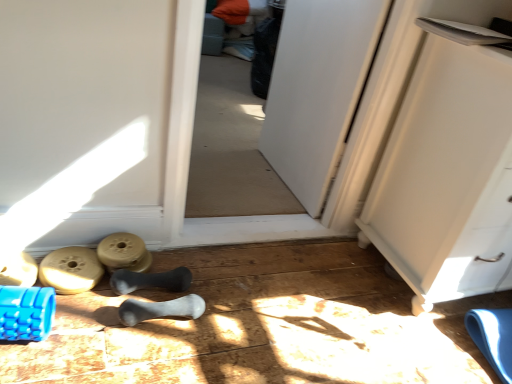
Image resolution: width=512 pixels, height=384 pixels. Describe the element at coordinates (160, 309) in the screenshot. I see `gray rubber bone at center, arranged as the first footwear when viewed from the right` at that location.

Find the location of a particular element. This screenshot has height=384, width=512. gray rubber bone at center, arranged as the 4th footwear when viewed from the left is located at coordinates 160,309.

What is the approximate width of blue textured foam roller at lower left, marked as the 1th job in a front-to-back arrangement?

blue textured foam roller at lower left, marked as the 1th job in a front-to-back arrangement, is 5.84 inches in width.

What do you see at coordinates (19, 271) in the screenshot?
I see `blue rubber roller at lower left, which appears as the fourth footwear when viewed from the right` at bounding box center [19, 271].

Find the location of a particular element. blue rubber roller at lower left, placed as the 1th footwear when sorted from left to right is located at coordinates (19, 271).

Where is `white matte cabinet at right`? This screenshot has height=384, width=512. white matte cabinet at right is located at coordinates 447,176.

The width and height of the screenshot is (512, 384). Find the location of `gray rubber bone at center, arranged as the first footwear when viewed from the right`. gray rubber bone at center, arranged as the first footwear when viewed from the right is located at coordinates (160, 309).

From a real-world perspective, which footwear is the 2nd one underneath the white matte cabinet at right? Please provide its 2D coordinates.

[(19, 271)]

Is blue rubber roller at lower left, which appears as the fourth footwear when viewed from the right, oriented towards white matte cabinet at right?

No, blue rubber roller at lower left, which appears as the fourth footwear when viewed from the right, is not turned towards white matte cabinet at right.

In the scene shown: Is blue rubber roller at lower left, placed as the 1th footwear when sorted from left to right, far away from white matte cabinet at right?

Yes, blue rubber roller at lower left, placed as the 1th footwear when sorted from left to right, and white matte cabinet at right are quite far apart.

Is gray rubber bone at center, which is the 3th footwear in left-to-right order, turned away from blue textured foam roller at lower left, positioned as the 2th job in right-to-left order?

No, gray rubber bone at center, which is the 3th footwear in left-to-right order,'s orientation is not away from blue textured foam roller at lower left, positioned as the 2th job in right-to-left order.

Would you say blue textured foam roller at lower left, positioned as the 2th job in right-to-left order, is part of gray rubber bone at center, positioned as the 2th footwear in right-to-left order,'s contents?

No, blue textured foam roller at lower left, positioned as the 2th job in right-to-left order, is not surrounded by gray rubber bone at center, positioned as the 2th footwear in right-to-left order.

Is gray rubber bone at center, positioned as the 2th footwear in right-to-left order, closer to the viewer compared to blue textured foam roller at lower left, marked as the 1th job in a front-to-back arrangement?

No, gray rubber bone at center, positioned as the 2th footwear in right-to-left order, is behind blue textured foam roller at lower left, marked as the 1th job in a front-to-back arrangement.

How far apart are matte rubber dumbbell at lower left, the 2th footwear when ordered from left to right, and white matte cabinet at right?

matte rubber dumbbell at lower left, the 2th footwear when ordered from left to right, and white matte cabinet at right are 1.16 meters apart.

Looking at this image, from the image's perspective, which is above, matte rubber dumbbell at lower left, which appears as the third footwear when viewed from the right, or white matte cabinet at right?

white matte cabinet at right appears higher in the image.

Between matte rubber dumbbell at lower left, which appears as the third footwear when viewed from the right, and white matte cabinet at right, which one has larger size?

white matte cabinet at right is bigger.

Considering the sizes of objects matte rubber dumbbell at lower left, which appears as the third footwear when viewed from the right, and white matte cabinet at right in the image provided, who is thinner, matte rubber dumbbell at lower left, which appears as the third footwear when viewed from the right, or white matte cabinet at right?

matte rubber dumbbell at lower left, which appears as the third footwear when viewed from the right, is thinner.

Is matte rubber dumbbell at lower left, which appears as the third footwear when viewed from the right, looking in the opposite direction of matte plastic weight at lower center, acting as the first job starting from the right?

matte rubber dumbbell at lower left, which appears as the third footwear when viewed from the right, is not turned away from matte plastic weight at lower center, acting as the first job starting from the right.

Consider the image. Choose the correct answer: Is matte rubber dumbbell at lower left, the 2th footwear when ordered from left to right, inside matte plastic weight at lower center, acting as the first job starting from the right, or outside it?

matte rubber dumbbell at lower left, the 2th footwear when ordered from left to right, is not inside matte plastic weight at lower center, acting as the first job starting from the right, it's outside.

From the image's perspective, between matte rubber dumbbell at lower left, the 2th footwear when ordered from left to right, and matte plastic weight at lower center, acting as the first job starting from the right, which one is located above?

matte plastic weight at lower center, acting as the first job starting from the right, from the image's perspective.

In the scene shown: From a real-world perspective, is matte rubber dumbbell at lower left, which appears as the third footwear when viewed from the right, positioned over matte plastic weight at lower center, the second job positioned from the left, based on gravity?

Actually, matte rubber dumbbell at lower left, which appears as the third footwear when viewed from the right, is physically below matte plastic weight at lower center, the second job positioned from the left, in the real world.

Is gray rubber bone at center, arranged as the first footwear when viewed from the right, facing away from blue textured foam roller at lower left, marked as the 1th job in a front-to-back arrangement?

gray rubber bone at center, arranged as the first footwear when viewed from the right, does not have its back to blue textured foam roller at lower left, marked as the 1th job in a front-to-back arrangement.

From the image's perspective, would you say gray rubber bone at center, arranged as the first footwear when viewed from the right, is shown under blue textured foam roller at lower left, acting as the second job starting from the back?

Yes, from the image's perspective, gray rubber bone at center, arranged as the first footwear when viewed from the right, is below blue textured foam roller at lower left, acting as the second job starting from the back.

Where is `the 2nd job to the left when counting from the gray rubber bone at center, arranged as the 4th footwear when viewed from the left`? This screenshot has width=512, height=384. the 2nd job to the left when counting from the gray rubber bone at center, arranged as the 4th footwear when viewed from the left is located at coordinates (26, 313).

Considering the relative sizes of matte rubber dumbbell at lower left, which appears as the third footwear when viewed from the right, and gray rubber bone at center, positioned as the 2th footwear in right-to-left order, in the image provided, is matte rubber dumbbell at lower left, which appears as the third footwear when viewed from the right, taller than gray rubber bone at center, positioned as the 2th footwear in right-to-left order,?

Incorrect, the height of matte rubber dumbbell at lower left, which appears as the third footwear when viewed from the right, is not larger of that of gray rubber bone at center, positioned as the 2th footwear in right-to-left order.

Measure the distance from matte rubber dumbbell at lower left, which appears as the third footwear when viewed from the right, to gray rubber bone at center, which is the 3th footwear in left-to-right order.

matte rubber dumbbell at lower left, which appears as the third footwear when viewed from the right, and gray rubber bone at center, which is the 3th footwear in left-to-right order, are 5.66 inches apart from each other.

Can you confirm if matte rubber dumbbell at lower left, which appears as the third footwear when viewed from the right, is wider than gray rubber bone at center, positioned as the 2th footwear in right-to-left order?

Yes, matte rubber dumbbell at lower left, which appears as the third footwear when viewed from the right, is wider than gray rubber bone at center, positioned as the 2th footwear in right-to-left order.

Is point (71, 281) positioned after point (173, 273)?

No, it is not.

In the scene shown: From a real-world perspective, is gray rubber bone at center, which is the 3th footwear in left-to-right order, physically located above or below blue rubber roller at lower left, which appears as the fourth footwear when viewed from the right?

In terms of real-world spatial position, gray rubber bone at center, which is the 3th footwear in left-to-right order, is below blue rubber roller at lower left, which appears as the fourth footwear when viewed from the right.

Is point (187, 270) more distant than point (35, 276)?

Yes, point (187, 270) is behind point (35, 276).

Considering the relative sizes of gray rubber bone at center, positioned as the 2th footwear in right-to-left order, and blue rubber roller at lower left, placed as the 1th footwear when sorted from left to right, in the image provided, is gray rubber bone at center, positioned as the 2th footwear in right-to-left order, wider than blue rubber roller at lower left, placed as the 1th footwear when sorted from left to right,?

Incorrect, the width of gray rubber bone at center, positioned as the 2th footwear in right-to-left order, does not surpass that of blue rubber roller at lower left, placed as the 1th footwear when sorted from left to right.

From the image's perspective, is gray rubber bone at center, which is the 3th footwear in left-to-right order, positioned above or below blue rubber roller at lower left, placed as the 1th footwear when sorted from left to right?

gray rubber bone at center, which is the 3th footwear in left-to-right order, is below blue rubber roller at lower left, placed as the 1th footwear when sorted from left to right.

From a real-world perspective, starting from the white matte cabinet at right, which footwear is the 2nd one below it? Please provide its 2D coordinates.

[(19, 271)]

I want to click on the 2nd footwear to the right of the blue textured foam roller at lower left, positioned as the 2th job in right-to-left order, starting your count from the anchor, so (150, 280).

Looking at the image, which one is located further to matte rubber dumbbell at lower left, which appears as the third footwear when viewed from the right, matte plastic weight at lower center, acting as the first job starting from the right, or blue textured foam roller at lower left, the 1th job from the left?

The object further to matte rubber dumbbell at lower left, which appears as the third footwear when viewed from the right, is blue textured foam roller at lower left, the 1th job from the left.

From the image, which object appears to be farther from blue textured foam roller at lower left, marked as the 1th job in a front-to-back arrangement, matte plastic weight at lower center, the 2th job from the front, or matte rubber dumbbell at lower left, the 2th footwear when ordered from left to right?

Among the two, matte plastic weight at lower center, the 2th job from the front, is located further to blue textured foam roller at lower left, marked as the 1th job in a front-to-back arrangement.

Considering their positions, is white matte cabinet at right positioned closer to gray rubber bone at center, arranged as the 4th footwear when viewed from the left, than matte rubber dumbbell at lower left, which appears as the third footwear when viewed from the right?

The object closer to gray rubber bone at center, arranged as the 4th footwear when viewed from the left, is matte rubber dumbbell at lower left, which appears as the third footwear when viewed from the right.

Estimate the real-world distances between objects in this image. Which object is further from matte rubber dumbbell at lower left, the 2th footwear when ordered from left to right, gray rubber bone at center, arranged as the first footwear when viewed from the right, or blue rubber roller at lower left, which appears as the fourth footwear when viewed from the right?

gray rubber bone at center, arranged as the first footwear when viewed from the right, lies further to matte rubber dumbbell at lower left, the 2th footwear when ordered from left to right, than the other object.

In the scene shown: Based on their spatial positions, is matte rubber dumbbell at lower left, the 2th footwear when ordered from left to right, or blue textured foam roller at lower left, marked as the 1th job in a front-to-back arrangement, closer to blue rubber roller at lower left, which appears as the fourth footwear when viewed from the right?

Based on the image, matte rubber dumbbell at lower left, the 2th footwear when ordered from left to right, appears to be nearer to blue rubber roller at lower left, which appears as the fourth footwear when viewed from the right.

Looking at this image, when comparing their distances from matte rubber dumbbell at lower left, which appears as the third footwear when viewed from the right, does gray rubber bone at center, positioned as the 2th footwear in right-to-left order, or gray rubber bone at center, arranged as the first footwear when viewed from the right, seem closer?

Among the two, gray rubber bone at center, positioned as the 2th footwear in right-to-left order, is located nearer to matte rubber dumbbell at lower left, which appears as the third footwear when viewed from the right.

Which object lies further to the anchor point blue textured foam roller at lower left, acting as the second job starting from the back, white matte cabinet at right or matte rubber dumbbell at lower left, the 2th footwear when ordered from left to right?

Based on the image, white matte cabinet at right appears to be further to blue textured foam roller at lower left, acting as the second job starting from the back.

When comparing their distances from matte rubber dumbbell at lower left, the 2th footwear when ordered from left to right, does white matte cabinet at right or gray rubber bone at center, positioned as the 2th footwear in right-to-left order, seem further?

Based on the image, white matte cabinet at right appears to be further to matte rubber dumbbell at lower left, the 2th footwear when ordered from left to right.

Locate an element on the screen. This screenshot has width=512, height=384. job between matte rubber dumbbell at lower left, the 2th footwear when ordered from left to right, and white matte cabinet at right, in the horizontal direction is located at coordinates (124, 253).

Locate an element on the screen. job situated between blue rubber roller at lower left, placed as the 1th footwear when sorted from left to right, and matte plastic weight at lower center, the 2th job from the front, from left to right is located at coordinates (26, 313).

Locate an element on the screen. The image size is (512, 384). footwear between gray rubber bone at center, which is the 3th footwear in left-to-right order, and white matte cabinet at right is located at coordinates (160, 309).

The image size is (512, 384). I want to click on footwear located between matte rubber dumbbell at lower left, which appears as the third footwear when viewed from the right, and gray rubber bone at center, arranged as the 4th footwear when viewed from the left, in the left-right direction, so click(150, 280).